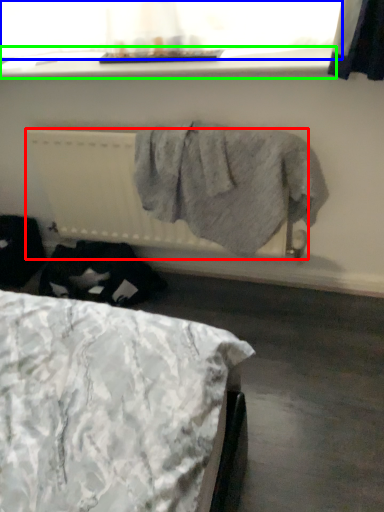
Question: Based on their relative distances, which object is nearer to radiator (highlighted by a red box)? Choose from window screen (highlighted by a blue box) and window sill (highlighted by a green box).

Choices:
 (A) window screen
 (B) window sill

Answer: (B)